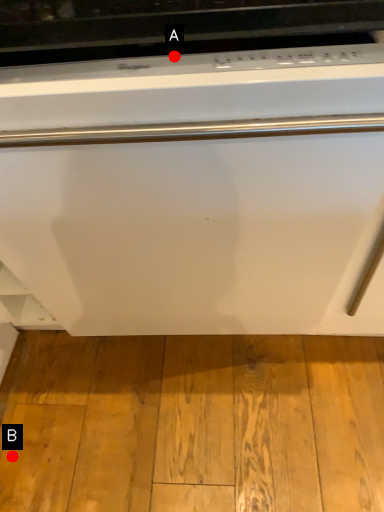
Question: Two points are circled on the image, labeled by A and B beside each circle. Which point appears farthest from the camera in this image?

Choices:
 (A) A is further
 (B) B is further

Answer: (B)